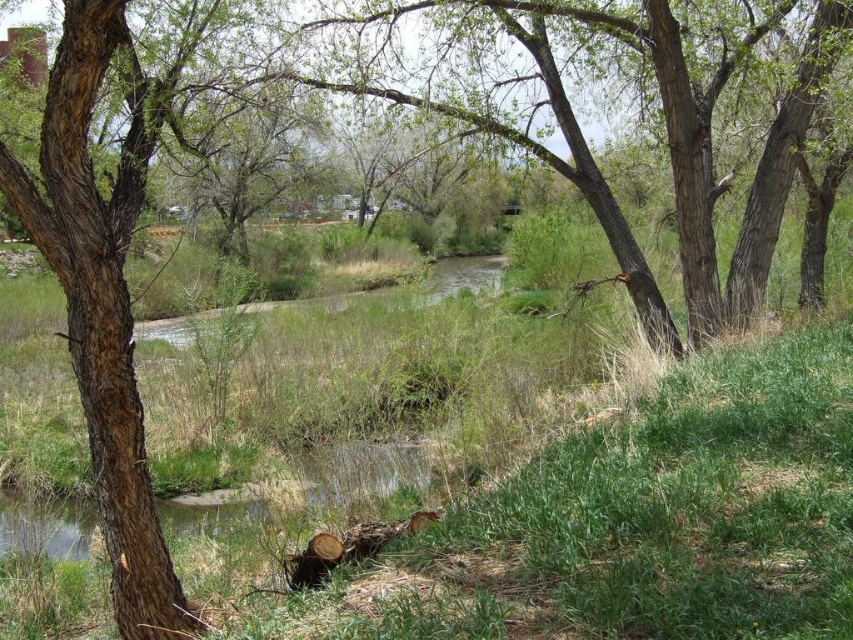
Can you confirm if green grass at center is positioned below brown rough bark tree trunk at left?

Correct, green grass at center is located below brown rough bark tree trunk at left.

Between green grass at center and brown rough bark tree trunk at left, which one is positioned lower?

green grass at center is below.

The width and height of the screenshot is (853, 640). What do you see at coordinates (556, 472) in the screenshot?
I see `green grass at center` at bounding box center [556, 472].

Where is `green grass at center`? green grass at center is located at coordinates (556, 472).

Is brown rough bark tree trunk at left behind brown rough tree at center?

That is False.

Who is shorter, brown rough bark tree trunk at left or brown rough tree at center?

With less height is brown rough tree at center.

Is point (131, 401) less distant than point (701, 193)?

Yes, it is in front of point (701, 193).

Where is `brown rough bark tree trunk at left`? The width and height of the screenshot is (853, 640). brown rough bark tree trunk at left is located at coordinates (102, 301).

Can you confirm if green grass at center is positioned above brown rough tree at center?

Incorrect, green grass at center is not positioned above brown rough tree at center.

Between point (231, 515) and point (761, 209), which one is positioned in front?

Point (231, 515) is in front.

Identify the location of green grass at center. (556, 472).